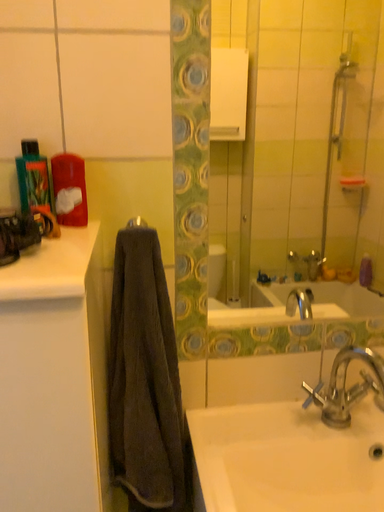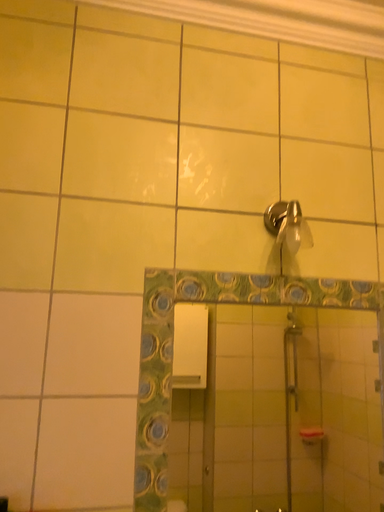
Question: How did the camera likely rotate when shooting the video?

Choices:
 (A) rotated upward
 (B) rotated downward

Answer: (A)